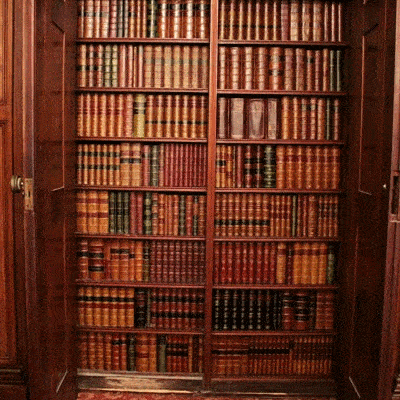
Locate an element on the screen. The image size is (400, 400). doors is located at coordinates (51, 143), (372, 246).